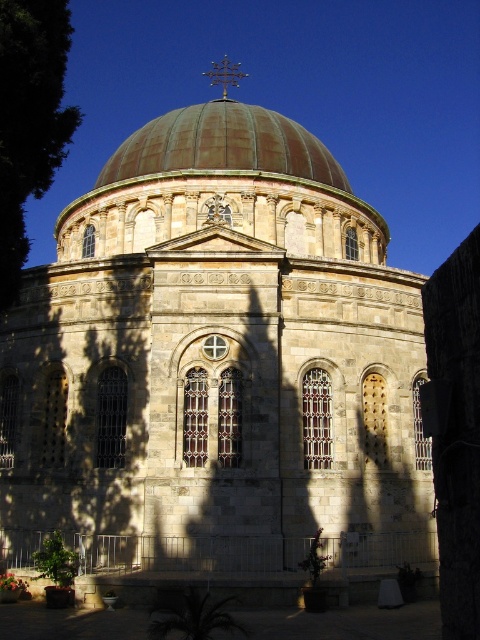
Does bronze/golden dome at center have a larger size compared to green leafy tree at left?

Indeed, bronze/golden dome at center has a larger size compared to green leafy tree at left.

Between point (309, 211) and point (13, 234), which one is positioned behind?

The point (309, 211) is behind.

Is point (386, 230) positioned in front of point (72, 124)?

No, (386, 230) is further to viewer.

Identify the location of bronze/golden dome at center. (223, 192).